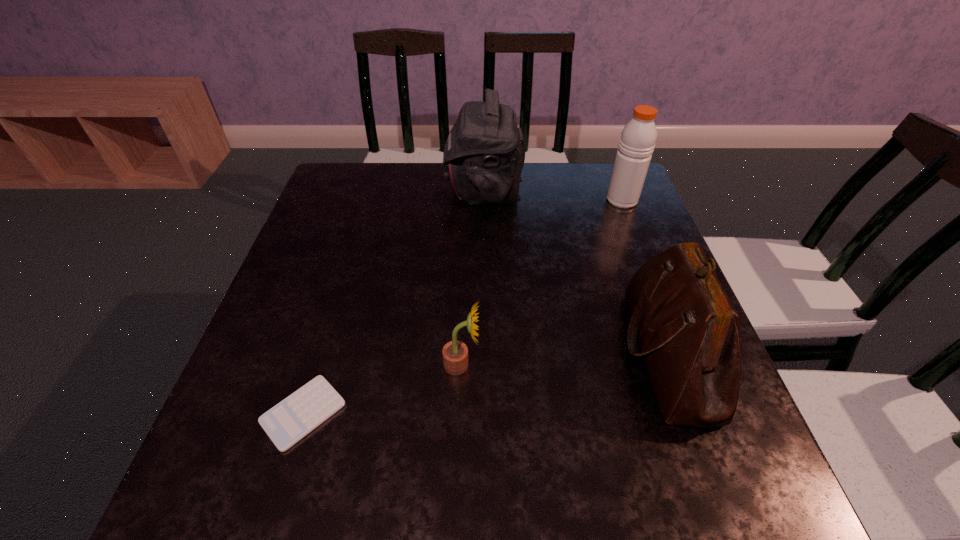
Locate an element on the screen. unoccupied area between the leftmost object and the shaker is located at coordinates (463, 306).

This screenshot has height=540, width=960. I want to click on free area in between the calculator and the nearer shoulder bag, so (x=486, y=383).

Locate which object ranks third in proximity to the nearer shoulder bag. Please provide its 2D coordinates. Your answer should be formatted as a tuple, i.e. [(x, y)], where the tuple contains the x and y coordinates of a point satisfying the conditions above.

[(484, 154)]

Identify the location of object that is the second closest to the leftmost object. Image resolution: width=960 pixels, height=540 pixels. (484, 154).

The image size is (960, 540). Identify the location of free point that satisfies the following two spatial constraints: 1. on the front side of the nearer shoulder bag; 2. on the face of the sunflower. (672, 364).

The height and width of the screenshot is (540, 960). In order to click on free location that satisfies the following two spatial constraints: 1. on the open flap of the shaker; 2. on the right side of the left shoulder bag in this screenshot , I will do `click(483, 200)`.

Where is `vacant space that satisfies the following two spatial constraints: 1. on the open flap of the left shoulder bag; 2. on the left side of the shaker`? The width and height of the screenshot is (960, 540). vacant space that satisfies the following two spatial constraints: 1. on the open flap of the left shoulder bag; 2. on the left side of the shaker is located at coordinates (483, 200).